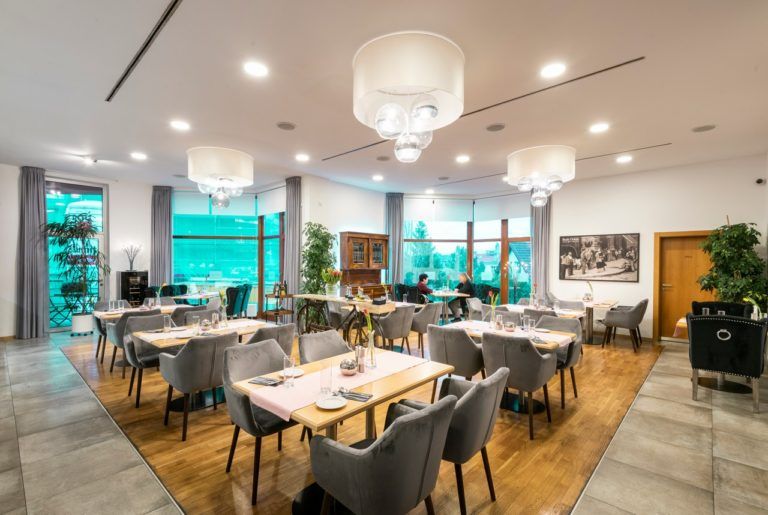
You are a GUI agent. You are given a task and a screenshot of the screen. Output one action in this format:
    pyautogui.click(x=<x>, y=<y>)
    Task: Click on the grey circles on ceiling
    
    Given the screenshot: What is the action you would take?
    pyautogui.click(x=697, y=125), pyautogui.click(x=495, y=126), pyautogui.click(x=442, y=179), pyautogui.click(x=386, y=159), pyautogui.click(x=288, y=123), pyautogui.click(x=174, y=173)